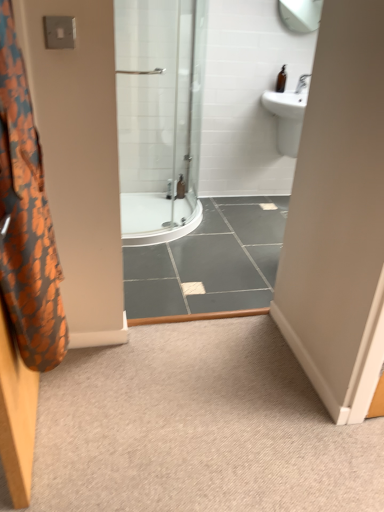
Question: Is orange fabric shower curtain at left situated inside brown glass bottle at upper right, which is the first toiletry from right to left, or outside?

Choices:
 (A) outside
 (B) inside

Answer: (A)

Question: From a real-world perspective, is orange fabric shower curtain at left positioned above or below brown glass bottle at upper right, marked as the 1th toiletry in a front-to-back arrangement?

Choices:
 (A) above
 (B) below

Answer: (B)

Question: Which object is the farthest from the brown glass bottle at upper right, which appears as the second toiletry when ordered from the bottom?

Choices:
 (A) orange fabric shower curtain at left
 (B) white glossy sink at upper right
 (C) clear plastic bottle at center, which is the 2th toiletry in front-to-back order
 (D) carpet at center

Answer: (A)

Question: Considering the real-world distances, which object is closest to the brown glass bottle at upper right, which ranks as the second toiletry in back-to-front order?

Choices:
 (A) carpet at center
 (B) clear plastic bottle at center, positioned as the second toiletry in right-to-left order
 (C) orange fabric shower curtain at left
 (D) white glossy sink at upper right

Answer: (D)